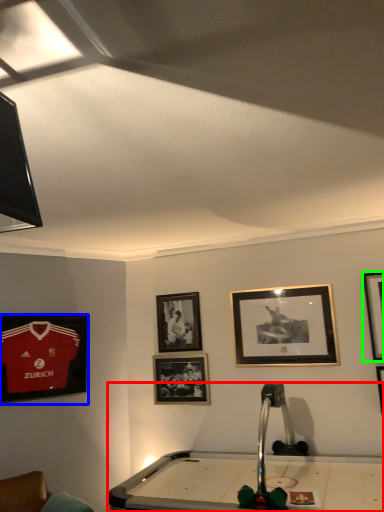
Question: Which object is positioned farthest from billiard table (highlighted by a red box)? Select from picture frame (highlighted by a blue box) and picture frame (highlighted by a green box).

Choices:
 (A) picture frame
 (B) picture frame

Answer: (A)